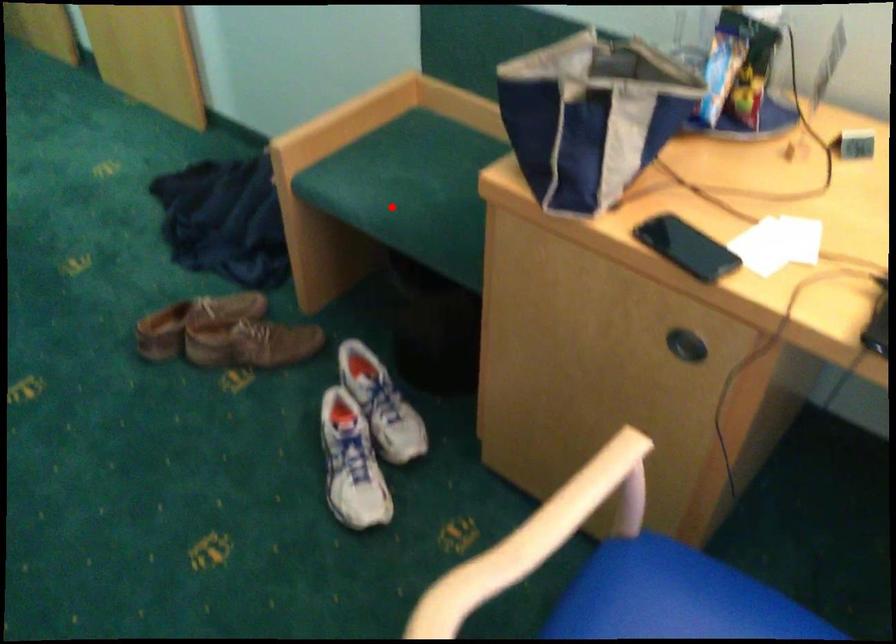
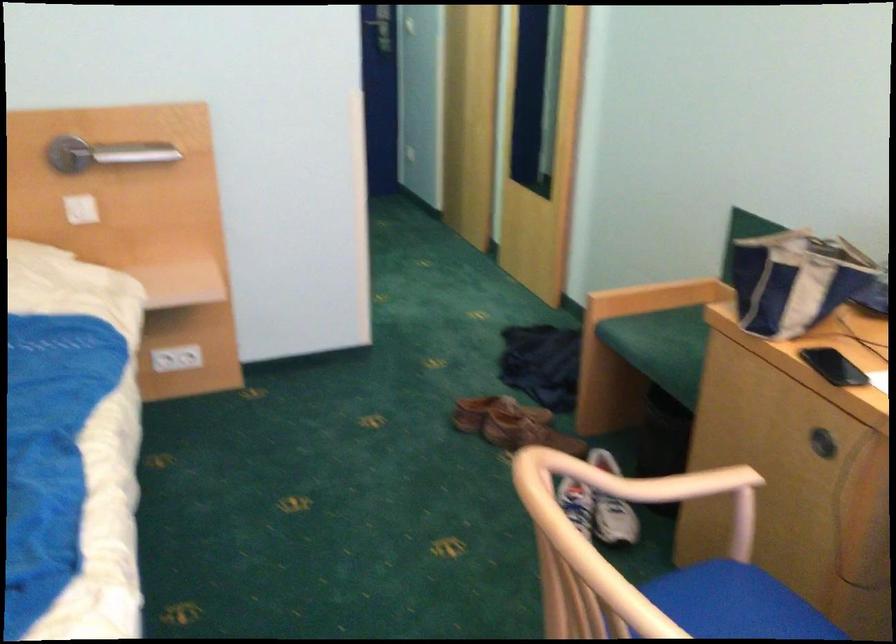
Question: I am providing you with two images of the same scene from different viewpoints. Given a red point in image1, look at the same physical point in image2. Is it:

Choices:
 (A) Closer to the viewpoint
 (B) Farther from the viewpoint

Answer: (B)